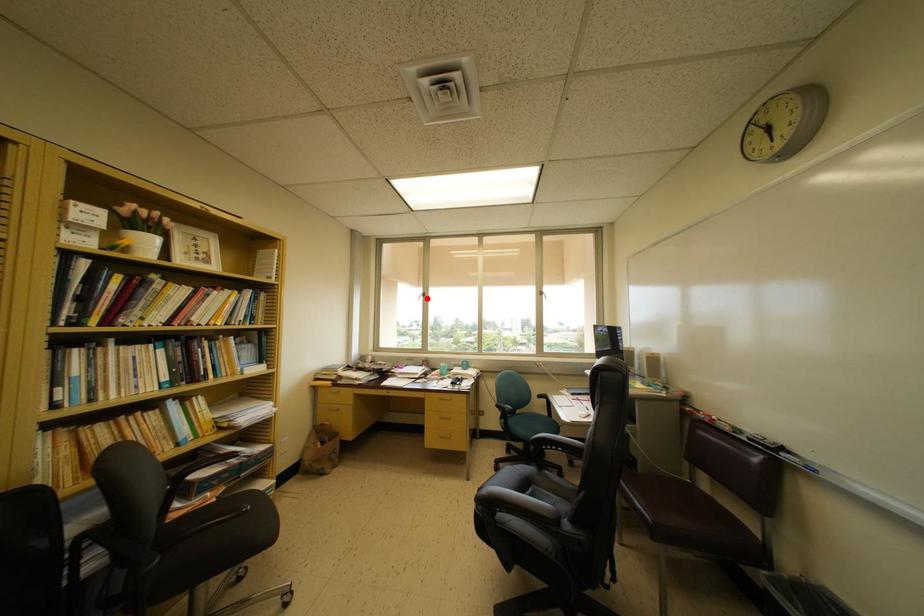
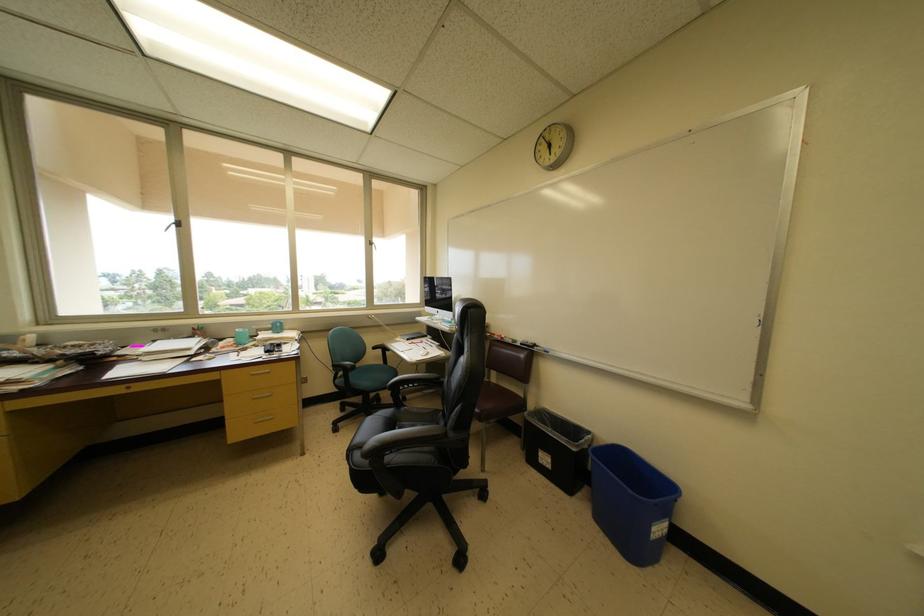
Find the pixel in the second image that matches the highlighted location in the first image.

(179, 225)